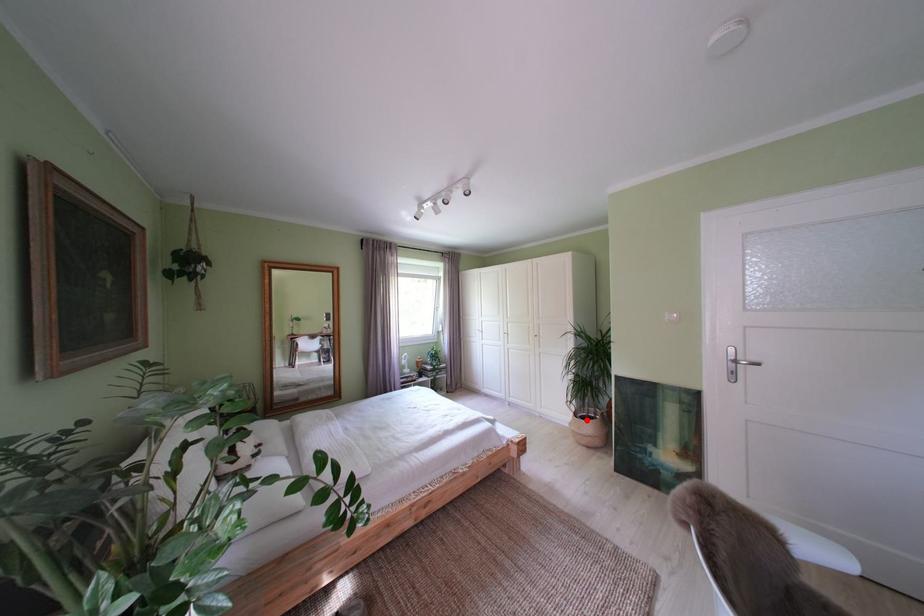
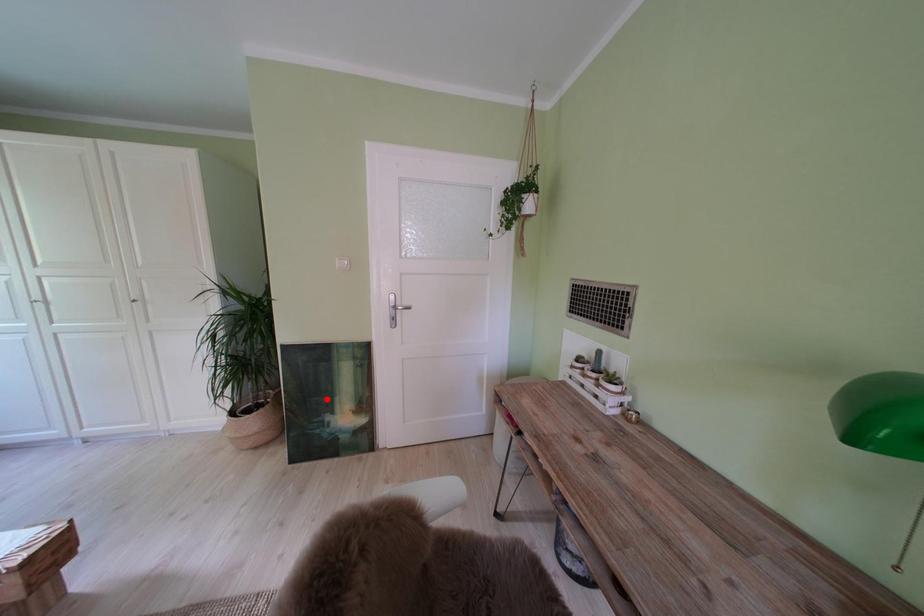
I am providing you with two images of the same scene from different viewpoints. A red point is marked on the first image and another point is marked on the second image. Is the marked point in image1 the same physical position as the marked point in image2?

No